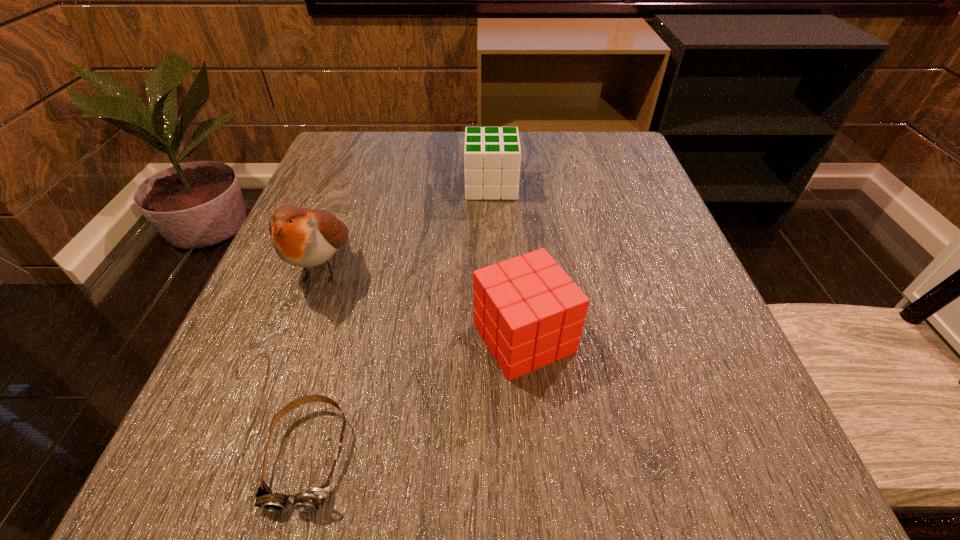
In order to click on object that is at the far edge in this screenshot , I will do `click(492, 156)`.

Locate an element on the screen. object that is at the near edge is located at coordinates (314, 498).

Locate an element on the screen. Image resolution: width=960 pixels, height=540 pixels. bird at the left edge is located at coordinates (303, 237).

You are a GUI agent. You are given a task and a screenshot of the screen. Output one action in this format:
    pyautogui.click(x=<x>, y=<y>)
    Task: Click on the goggles that is at the left edge
    The width and height of the screenshot is (960, 540).
    Given the screenshot: What is the action you would take?
    pyautogui.click(x=314, y=498)

Find the location of `object situated at the near left corner`. object situated at the near left corner is located at coordinates (314, 498).

Locate an element on the screen. vacant space at the far edge of the desktop is located at coordinates (463, 146).

Where is `free location at the near edge`? Image resolution: width=960 pixels, height=540 pixels. free location at the near edge is located at coordinates (548, 464).

I want to click on vacant space at the left edge, so click(x=321, y=309).

Where is `blank space at the right edge of the desktop`? The width and height of the screenshot is (960, 540). blank space at the right edge of the desktop is located at coordinates (618, 199).

This screenshot has height=540, width=960. In the image, there is a desktop. Find the location of `vacant space at the far left corner`. vacant space at the far left corner is located at coordinates (357, 152).